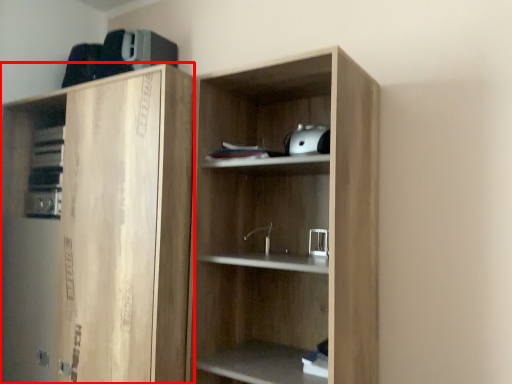
Question: From the image, what is the correct spatial relationship of cabinetry (annotated by the red box) in relation to cupboard?

Choices:
 (A) right
 (B) left

Answer: (B)